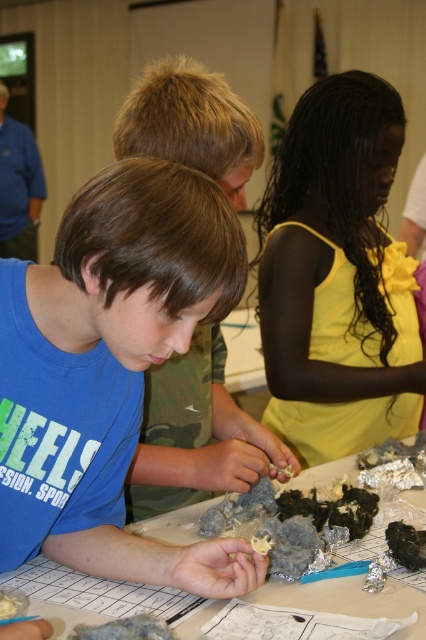
You are a photographer trying to capture a group photo of the matte blue shirt at center and the yellow satin dress at center. The camera you are using has a minimum focusing distance of 70 centimeters. Will you be able to take a clear photo of both subjects at the same time?

The distance between the matte blue shirt at center and the yellow satin dress at center is 69.83 centimeters. Since the camera requires a minimum focusing distance of 70 centimeters, you will need to move slightly closer or adjust the camera settings to ensure both subjects are in focus.

You are a photographer trying to capture a closeup of the white crumbly food at center without including the yellow satin dress at center in the frame. Based on their positions, is this possible?

The yellow satin dress at center is to the right of the white crumbly food at center, so by positioning the camera to the left side of the white crumbly food at center and framing the shot to exclude the right side, it should be possible to capture the white crumbly food at center without including the yellow satin dress at center.